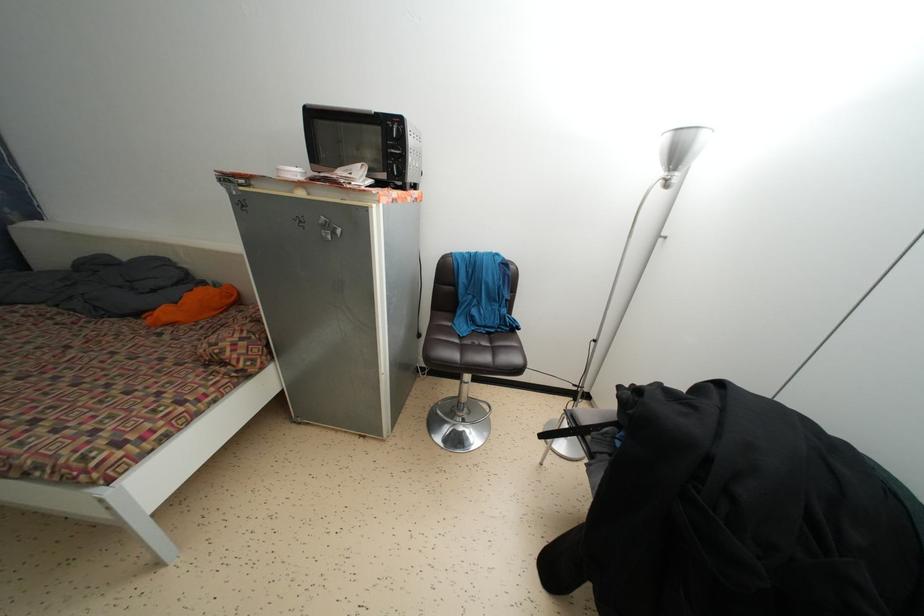
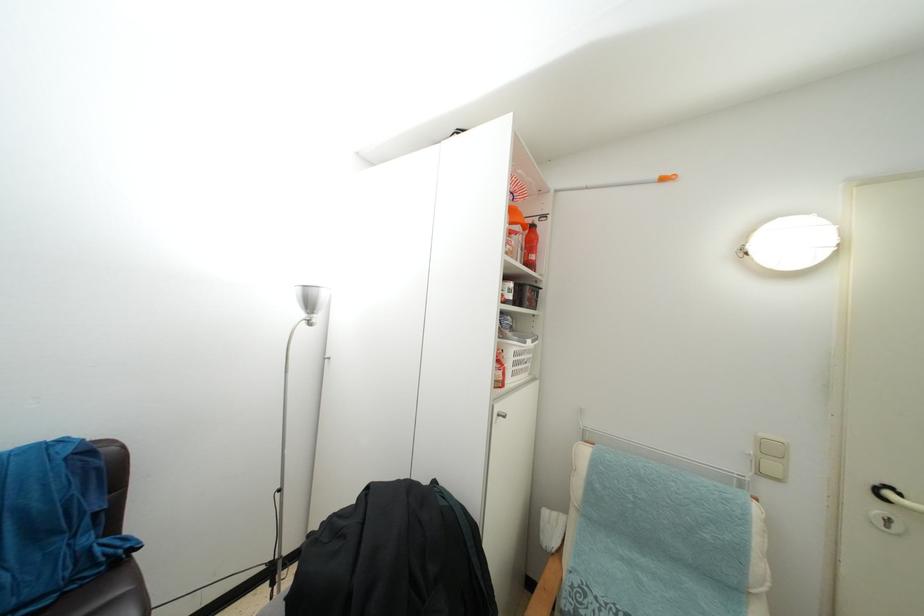
Where in the second image is the point corresponding to pixel 673 140 from the first image?

(304, 294)